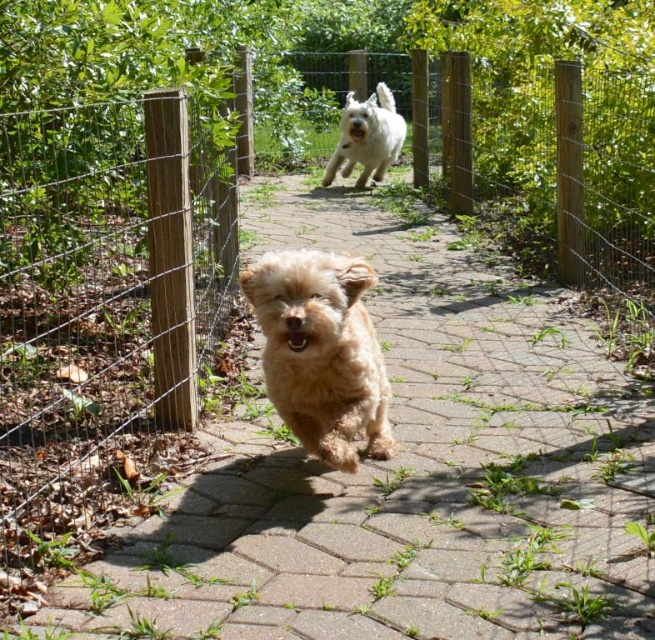
Question: Is brown brick path at center positioned behind white fluffy dog at center?

Choices:
 (A) yes
 (B) no

Answer: (B)

Question: Can you confirm if brown brick path at center is positioned below wooden post at left?

Choices:
 (A) no
 (B) yes

Answer: (B)

Question: Which of the following is the farthest from the observer?

Choices:
 (A) wooden post at left
 (B) white fluffy dog at center
 (C) fuzzy golden dog at center

Answer: (B)

Question: Where is brown brick path at center located in relation to white fluffy dog at center in the image?

Choices:
 (A) right
 (B) left

Answer: (A)

Question: Which point appears closest to the camera in this image?

Choices:
 (A) (390, 145)
 (B) (447, 525)

Answer: (B)

Question: Which of these objects is positioned closest to the wooden post at left?

Choices:
 (A) fuzzy golden dog at center
 (B) white fluffy dog at center

Answer: (A)